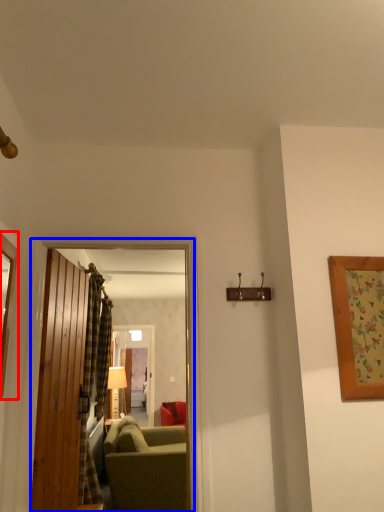
Question: Among these objects, which one is nearest to the camera, picture frame (highlighted by a red box) or door (highlighted by a blue box)?

Choices:
 (A) picture frame
 (B) door

Answer: (A)